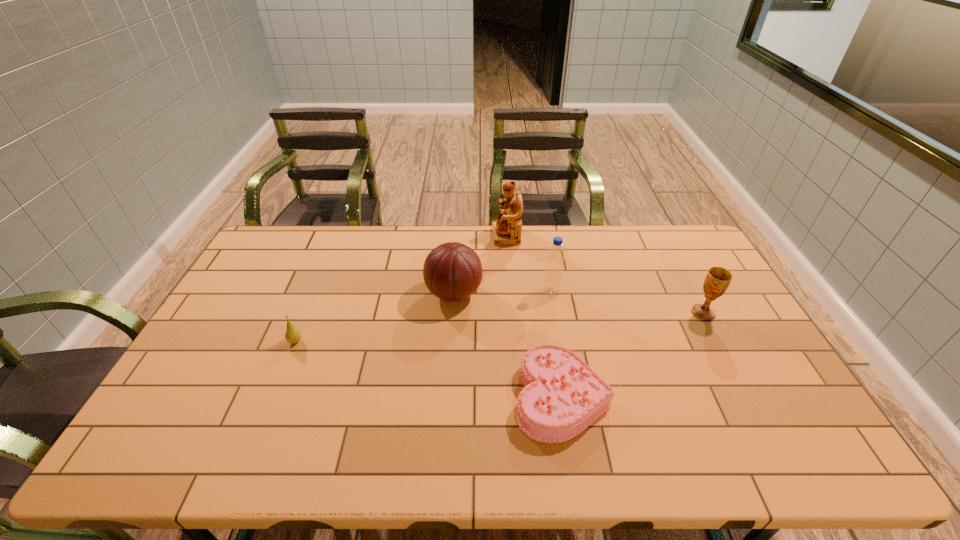
Locate an element on the screen. This screenshot has height=540, width=960. vacant region at the far edge of the desktop is located at coordinates (630, 263).

Locate an element on the screen. The height and width of the screenshot is (540, 960). vacant space at the near edge of the desktop is located at coordinates (463, 442).

The width and height of the screenshot is (960, 540). In the image, there is a desktop. Find the location of `vacant area at the left edge`. vacant area at the left edge is located at coordinates [180, 407].

Where is `blank space at the right edge of the desktop`? Image resolution: width=960 pixels, height=540 pixels. blank space at the right edge of the desktop is located at coordinates (743, 366).

Find the location of a particular element. Image resolution: width=960 pixels, height=540 pixels. free region at the far left corner is located at coordinates (302, 237).

This screenshot has height=540, width=960. I want to click on free space between the nearest object and the third shortest object, so click(633, 355).

Where is `unoccupied area between the nearest object and the pear`? unoccupied area between the nearest object and the pear is located at coordinates (428, 369).

The width and height of the screenshot is (960, 540). In order to click on free space between the shortest object and the chalice in this screenshot , I will do `click(633, 355)`.

Find the location of a particular element. The image size is (960, 540). vacant space that is in between the farthest object and the shortest object is located at coordinates (534, 316).

This screenshot has width=960, height=540. In order to click on free space between the second shortest object and the farthest object in this screenshot , I will do `click(401, 289)`.